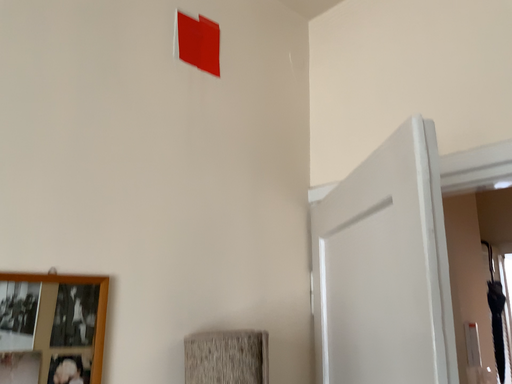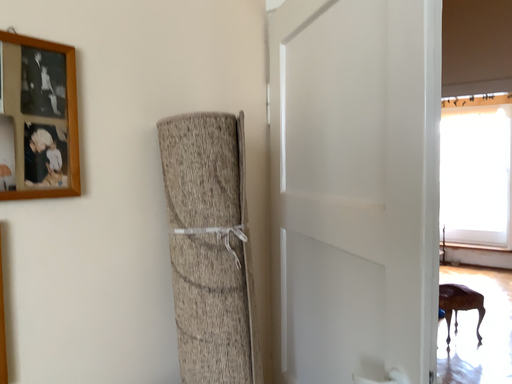
Question: Which way did the camera rotate in the video?

Choices:
 (A) rotated upward
 (B) rotated downward

Answer: (B)